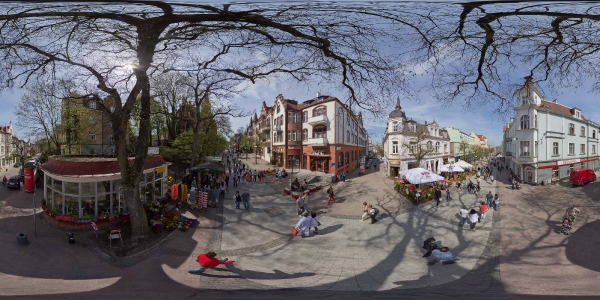
Locate an element on the screen. The width and height of the screenshot is (600, 300). trashcan is located at coordinates (26, 241).